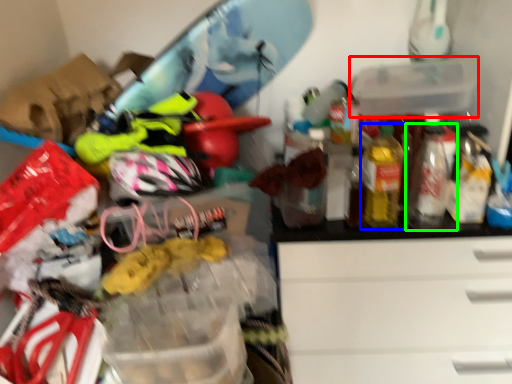
Question: Based on their relative distances, which object is nearer to storage box (highlighted by a red box)? Choose from bottle (highlighted by a blue box) and bottle (highlighted by a green box).

Choices:
 (A) bottle
 (B) bottle

Answer: (A)